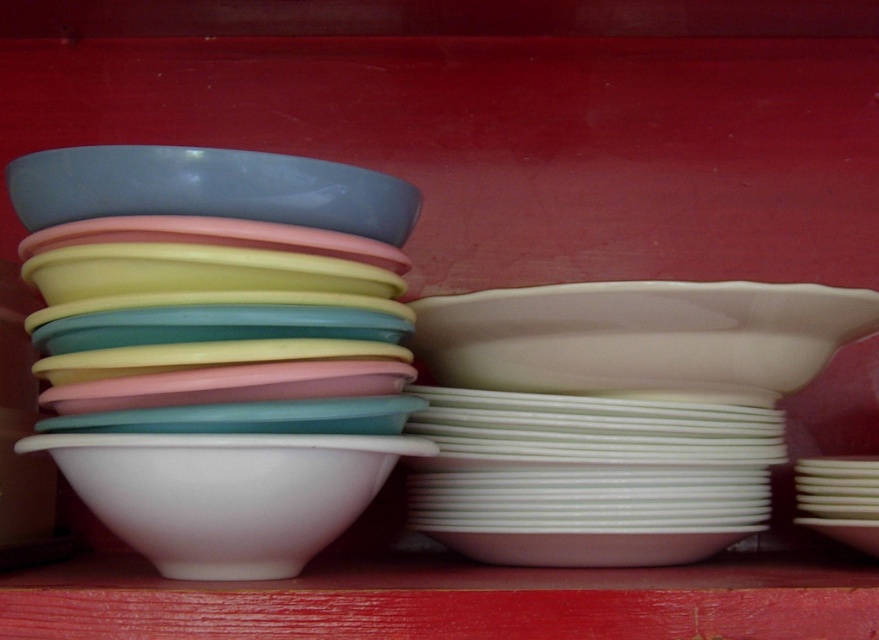
Question: Which point is closer to the camera?

Choices:
 (A) white glossy bowl at right
 (B) matte blue bowl at upper left
 (C) white glossy bowl at center

Answer: (C)

Question: Is the position of white glossy bowl at right less distant than that of white glossy bowl at center?

Choices:
 (A) no
 (B) yes

Answer: (A)

Question: Which object is positioned closest to the white glossy bowl at center?

Choices:
 (A) white glossy bowl at right
 (B) matte blue bowl at upper left

Answer: (B)

Question: Among these points, which one is farthest from the camera?

Choices:
 (A) (178, 435)
 (B) (401, 182)

Answer: (B)

Question: Is white glossy bowl at right further to the viewer compared to white glossy bowl at center?

Choices:
 (A) no
 (B) yes

Answer: (B)

Question: Is white glossy bowl at center bigger than matte blue bowl at upper left?

Choices:
 (A) yes
 (B) no

Answer: (A)